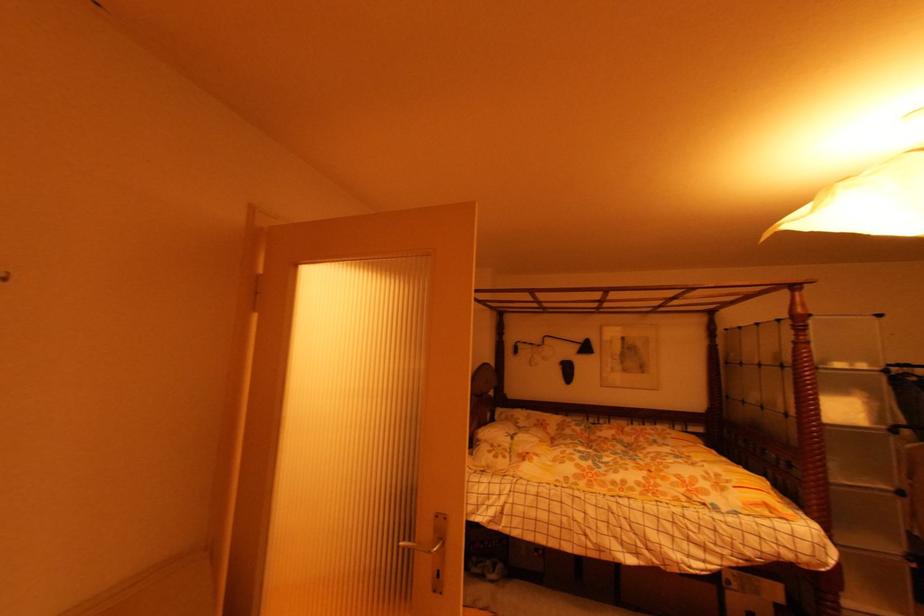
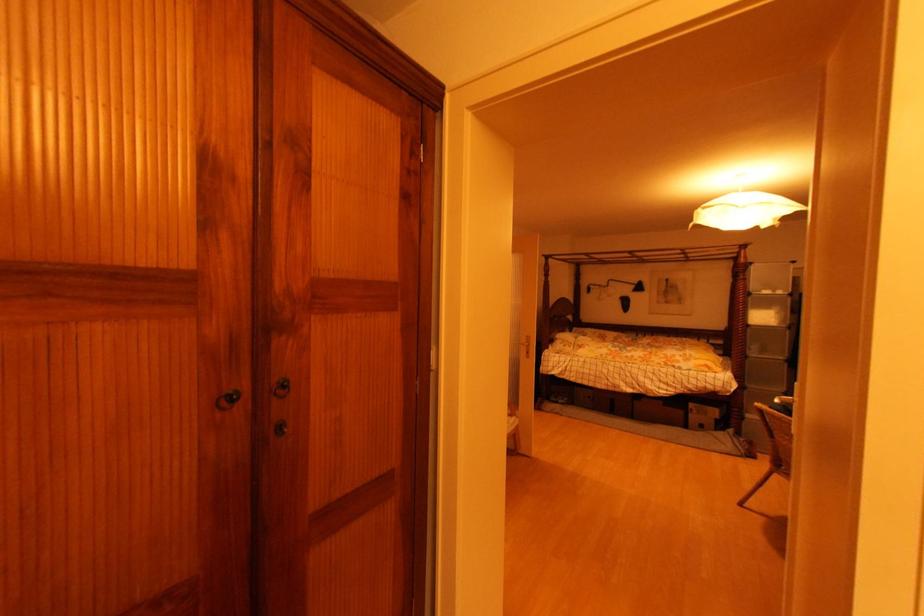
Find the pixel in the second image that matches point (867, 368) in the first image.

(784, 294)